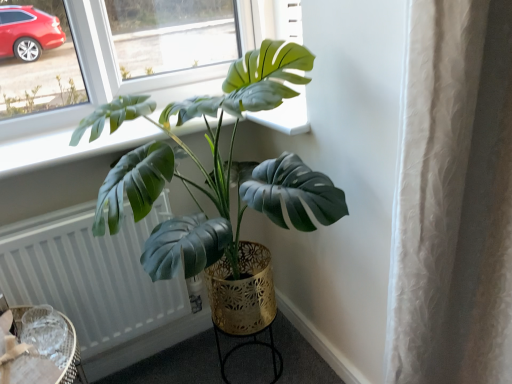
This screenshot has width=512, height=384. What do you see at coordinates (247, 345) in the screenshot?
I see `gold metallic round table at lower center, arranged as the first round table when viewed from the right` at bounding box center [247, 345].

Measure the distance between point (95,284) and camera.

Point (95,284) is 3.90 feet from camera.

I want to click on white textured radiator at lower left, so click(x=90, y=274).

You are a GUI agent. You are given a task and a screenshot of the screen. Output one action in this format:
    pyautogui.click(x=<x>, y=<y>)
    Task: Click on the woven rattan table at lower left, the first round table viewed from the left
    Image resolution: width=512 pixels, height=384 pixels.
    Given the screenshot: What is the action you would take?
    pyautogui.click(x=73, y=359)

Image resolution: width=512 pixels, height=384 pixels. I want to click on gold metallic round table at lower center, marked as the first round table in a back-to-front arrangement, so click(247, 345).

From a real-world perspective, which is physically above, green matte plant at center or white textured radiator at lower left?

In real-world perspective, green matte plant at center is above.

Who is smaller, green matte plant at center or white textured radiator at lower left?

white textured radiator at lower left is smaller.

Between green matte plant at center and white textured radiator at lower left, which one has more height?

green matte plant at center.

Considering the relative positions of green matte plant at center and white textured radiator at lower left in the image provided, is green matte plant at center behind white textured radiator at lower left?

That is False.

Considering the relative sizes of gold metallic round table at lower center, which is the second round table from left to right, and white textured radiator at lower left in the image provided, is gold metallic round table at lower center, which is the second round table from left to right, wider than white textured radiator at lower left?

Indeed, gold metallic round table at lower center, which is the second round table from left to right, has a greater width compared to white textured radiator at lower left.

Which is less distant, (276,375) or (135,248)?

The point (135,248) is closer to the camera.

Choose the correct answer: Is gold metallic round table at lower center, which is counted as the second round table, starting from the front, inside white textured radiator at lower left or outside it?

gold metallic round table at lower center, which is counted as the second round table, starting from the front, lies outside white textured radiator at lower left.

From a real-world perspective, who is located higher, gold metallic round table at lower center, which is counted as the second round table, starting from the front, or white textured radiator at lower left?

From a 3D spatial view, white textured radiator at lower left is above.

Consider the image. From a real-world perspective, is woven rattan table at lower left, the first round table viewed from the left, over green matte plant at center?

No.

Is woven rattan table at lower left, which is counted as the first round table, starting from the front, facing away from green matte plant at center?

No, woven rattan table at lower left, which is counted as the first round table, starting from the front, is not facing away from green matte plant at center.

Which object is closer to the camera, woven rattan table at lower left, the first round table viewed from the left, or green matte plant at center?

Positioned in front is green matte plant at center.

Can you tell me how much woven rattan table at lower left, placed as the 2th round table when sorted from back to front, and green matte plant at center differ in facing direction?

24.1 degrees.

Would you say gold metallic round table at lower center, marked as the first round table in a back-to-front arrangement, is to the left or to the right of woven rattan table at lower left, the first round table viewed from the left, in the picture?

From the image, it's evident that gold metallic round table at lower center, marked as the first round table in a back-to-front arrangement, is to the right of woven rattan table at lower left, the first round table viewed from the left.

Considering the relative sizes of gold metallic round table at lower center, marked as the first round table in a back-to-front arrangement, and woven rattan table at lower left, placed as the 2th round table when sorted from back to front, in the image provided, is gold metallic round table at lower center, marked as the first round table in a back-to-front arrangement, wider than woven rattan table at lower left, placed as the 2th round table when sorted from back to front,?

Yes.

How different are the orientations of gold metallic round table at lower center, arranged as the first round table when viewed from the right, and woven rattan table at lower left, which is counted as the first round table, starting from the front, in degrees?

There is a 26.9-degree angle between the facing directions of gold metallic round table at lower center, arranged as the first round table when viewed from the right, and woven rattan table at lower left, which is counted as the first round table, starting from the front.

Would you say woven rattan table at lower left, the first round table viewed from the left, is part of gold metallic round table at lower center, which is counted as the second round table, starting from the front,'s contents?

No.

Could you tell me if green matte plant at center is turned towards woven rattan table at lower left, which is counted as the first round table, starting from the front?

No, green matte plant at center is not aimed at woven rattan table at lower left, which is counted as the first round table, starting from the front.

Does point (173, 159) appear closer or farther from the camera than point (82, 376)?

Point (173, 159) is closer to the camera than point (82, 376).

Does green matte plant at center have a lesser height compared to woven rattan table at lower left, placed as the 2th round table when sorted from back to front?

In fact, green matte plant at center may be taller than woven rattan table at lower left, placed as the 2th round table when sorted from back to front.

Is green matte plant at center positioned before woven rattan table at lower left, acting as the second round table starting from the right?

That is True.

There is a white textured radiator at lower left. Where is `round table above it (from a real-world perspective)`? This screenshot has height=384, width=512. round table above it (from a real-world perspective) is located at coordinates (73, 359).

Which is more to the right, white textured radiator at lower left or woven rattan table at lower left, the first round table viewed from the left?

From the viewer's perspective, white textured radiator at lower left appears more on the right side.

Which object is more forward, white textured radiator at lower left or woven rattan table at lower left, which is counted as the first round table, starting from the front?

woven rattan table at lower left, which is counted as the first round table, starting from the front, is closer to the camera.

Are white textured radiator at lower left and woven rattan table at lower left, acting as the second round table starting from the right, far apart?

No, white textured radiator at lower left is in close proximity to woven rattan table at lower left, acting as the second round table starting from the right.

Choose the correct answer: Is woven rattan table at lower left, acting as the second round table starting from the right, inside white textured radiator at lower left or outside it?

woven rattan table at lower left, acting as the second round table starting from the right, is not enclosed by white textured radiator at lower left.

From the picture: From the image's perspective, would you say woven rattan table at lower left, acting as the second round table starting from the right, is shown under white textured radiator at lower left?

Yes, from the image's perspective, woven rattan table at lower left, acting as the second round table starting from the right, is beneath white textured radiator at lower left.

How far apart are woven rattan table at lower left, the first round table viewed from the left, and white textured radiator at lower left?

woven rattan table at lower left, the first round table viewed from the left, is 7.10 inches from white textured radiator at lower left.

Is woven rattan table at lower left, which is counted as the first round table, starting from the front, positioned with its back to white textured radiator at lower left?

No, white textured radiator at lower left is not at the back of woven rattan table at lower left, which is counted as the first round table, starting from the front.

Where is `radiator that is below the green matte plant at center (from the image's perspective)`? This screenshot has width=512, height=384. radiator that is below the green matte plant at center (from the image's perspective) is located at coordinates (90, 274).

Locate an element on the screen. The image size is (512, 384). radiator located above the gold metallic round table at lower center, which is counted as the second round table, starting from the front (from a real-world perspective) is located at coordinates (90, 274).

Looking at the image, which one is located further to green matte plant at center, gold metallic round table at lower center, which is the second round table from left to right, or white textured radiator at lower left?

Among the two, gold metallic round table at lower center, which is the second round table from left to right, is located further to green matte plant at center.

When comparing their distances from green matte plant at center, does white textured radiator at lower left or woven rattan table at lower left, acting as the second round table starting from the right, seem further?

woven rattan table at lower left, acting as the second round table starting from the right, lies further to green matte plant at center than the other object.

Which object lies nearer to the anchor point white textured radiator at lower left, woven rattan table at lower left, placed as the 2th round table when sorted from back to front, or gold metallic round table at lower center, marked as the first round table in a back-to-front arrangement?

woven rattan table at lower left, placed as the 2th round table when sorted from back to front, lies closer to white textured radiator at lower left than the other object.

Based on their spatial positions, is white textured radiator at lower left or gold metallic round table at lower center, which is counted as the second round table, starting from the front, further from green matte plant at center?

Based on the image, gold metallic round table at lower center, which is counted as the second round table, starting from the front, appears to be further to green matte plant at center.

Considering their positions, is white textured radiator at lower left positioned further to woven rattan table at lower left, placed as the 2th round table when sorted from back to front, than green matte plant at center?

Among the two, green matte plant at center is located further to woven rattan table at lower left, placed as the 2th round table when sorted from back to front.

Which object lies further to the anchor point green matte plant at center, woven rattan table at lower left, the first round table viewed from the left, or white textured radiator at lower left?

The object further to green matte plant at center is woven rattan table at lower left, the first round table viewed from the left.

Based on their spatial positions, is woven rattan table at lower left, the first round table viewed from the left, or white textured radiator at lower left closer to gold metallic round table at lower center, marked as the first round table in a back-to-front arrangement?

white textured radiator at lower left is positioned closer to the anchor gold metallic round table at lower center, marked as the first round table in a back-to-front arrangement.

When comparing their distances from white textured radiator at lower left, does green matte plant at center or woven rattan table at lower left, acting as the second round table starting from the right, seem closer?

Among the two, woven rattan table at lower left, acting as the second round table starting from the right, is located nearer to white textured radiator at lower left.

Find the location of a particular element. This screenshot has height=384, width=512. radiator between woven rattan table at lower left, which is counted as the first round table, starting from the front, and gold metallic round table at lower center, arranged as the first round table when viewed from the right, in the horizontal direction is located at coordinates (90, 274).

What are the coordinates of `radiator positioned between green matte plant at center and gold metallic round table at lower center, which is the second round table from left to right, from near to far` in the screenshot? It's located at (90, 274).

Locate an element on the screen. The image size is (512, 384). round table between green matte plant at center and gold metallic round table at lower center, marked as the first round table in a back-to-front arrangement, along the z-axis is located at coordinates (73, 359).

The image size is (512, 384). In order to click on round table positioned between green matte plant at center and white textured radiator at lower left from near to far in this screenshot , I will do `click(73, 359)`.